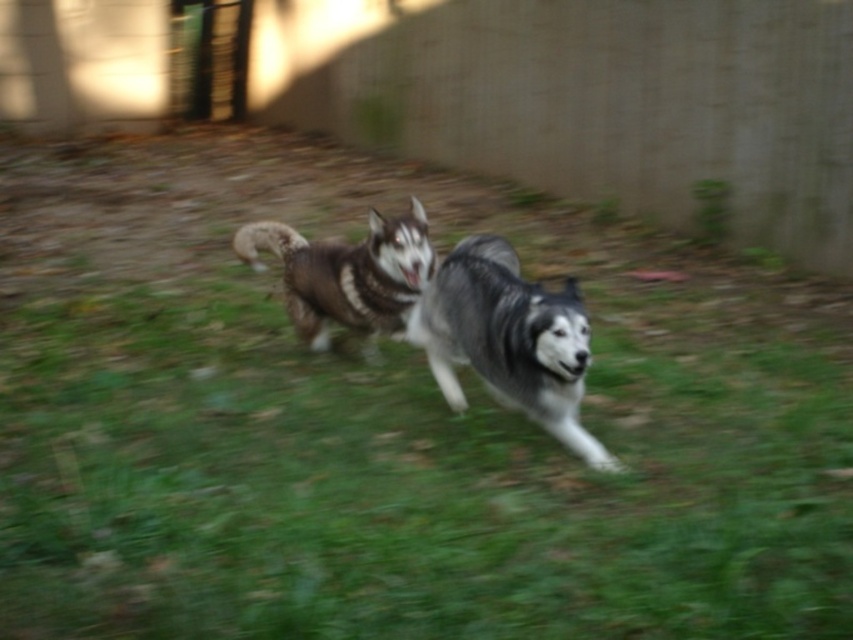
Question: Which point is farther from the camera taking this photo?

Choices:
 (A) (708, 600)
 (B) (509, 394)

Answer: (B)

Question: Based on their relative distances, which object is nearer to the green grass at center?

Choices:
 (A) gray-black fur dog at center
 (B) brown fur husky at center

Answer: (A)

Question: Which object appears closest to the camera in this image?

Choices:
 (A) green grass at center
 (B) brown fur husky at center

Answer: (A)

Question: Can you confirm if gray-black fur dog at center is positioned to the left of brown fur husky at center?

Choices:
 (A) no
 (B) yes

Answer: (A)

Question: Does gray-black fur dog at center have a lesser width compared to brown fur husky at center?

Choices:
 (A) yes
 (B) no

Answer: (A)

Question: Is green grass at center smaller than gray-black fur dog at center?

Choices:
 (A) no
 (B) yes

Answer: (A)